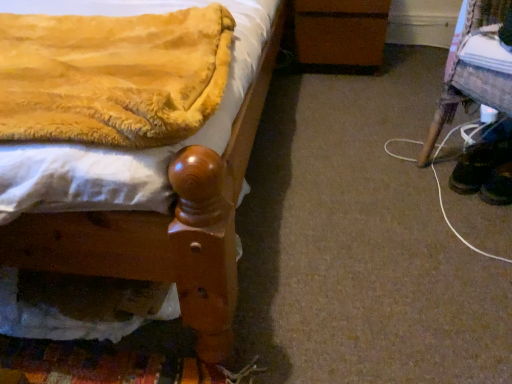
Locate an element on the screen. The width and height of the screenshot is (512, 384). vacant space situated on the left part of black suede shoes at lower right, the first footwear when ordered from right to left is located at coordinates (453, 197).